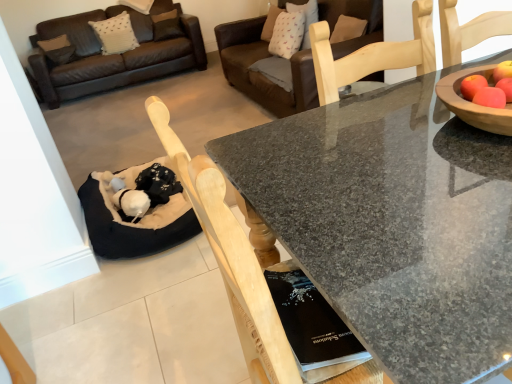
The image size is (512, 384). I want to click on vacant area on top of granite table at center (from a real-world perspective), so click(x=390, y=158).